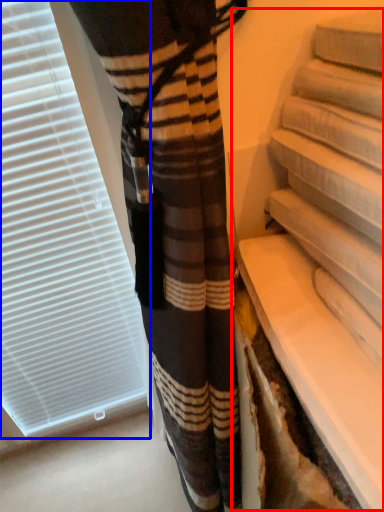
Question: Which object is closer to the camera taking this photo, shelf (highlighted by a red box) or window blind (highlighted by a blue box)?

Choices:
 (A) shelf
 (B) window blind

Answer: (A)